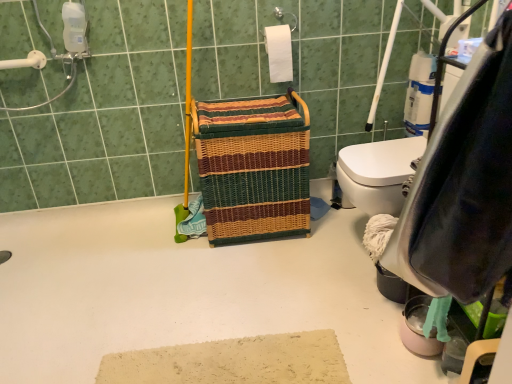
Question: Is woven multicolored laundry basket at center at the back of white plastic grab bar at upper left?

Choices:
 (A) yes
 (B) no

Answer: (B)

Question: Considering the relative positions of white plastic grab bar at upper left and woven multicolored laundry basket at center in the image provided, is white plastic grab bar at upper left to the right of woven multicolored laundry basket at center from the viewer's perspective?

Choices:
 (A) no
 (B) yes

Answer: (A)

Question: Can you confirm if white plastic grab bar at upper left is bigger than woven multicolored laundry basket at center?

Choices:
 (A) yes
 (B) no

Answer: (B)

Question: Is white plastic grab bar at upper left surrounding woven multicolored laundry basket at center?

Choices:
 (A) yes
 (B) no

Answer: (B)

Question: From a real-world perspective, is white plastic grab bar at upper left on woven multicolored laundry basket at center?

Choices:
 (A) no
 (B) yes

Answer: (B)

Question: Can you confirm if white plastic grab bar at upper left is taller than woven multicolored laundry basket at center?

Choices:
 (A) yes
 (B) no

Answer: (B)

Question: Is white plastic grab bar at upper left facing away from white matte toilet paper at upper center?

Choices:
 (A) yes
 (B) no

Answer: (B)

Question: From the image's perspective, is white plastic grab bar at upper left beneath white matte toilet paper at upper center?

Choices:
 (A) yes
 (B) no

Answer: (A)

Question: Can you confirm if white plastic grab bar at upper left is wider than white matte toilet paper at upper center?

Choices:
 (A) no
 (B) yes

Answer: (A)

Question: From a real-world perspective, is white plastic grab bar at upper left below white matte toilet paper at upper center?

Choices:
 (A) yes
 (B) no

Answer: (B)

Question: Can you confirm if white plastic grab bar at upper left is positioned to the right of white matte toilet paper at upper center?

Choices:
 (A) yes
 (B) no

Answer: (B)

Question: Considering the relative sizes of white plastic grab bar at upper left and white matte toilet paper at upper center in the image provided, is white plastic grab bar at upper left thinner than white matte toilet paper at upper center?

Choices:
 (A) yes
 (B) no

Answer: (A)

Question: Would you say white matte toilet paper at upper center is a long distance from woven multicolored laundry basket at center?

Choices:
 (A) no
 (B) yes

Answer: (A)